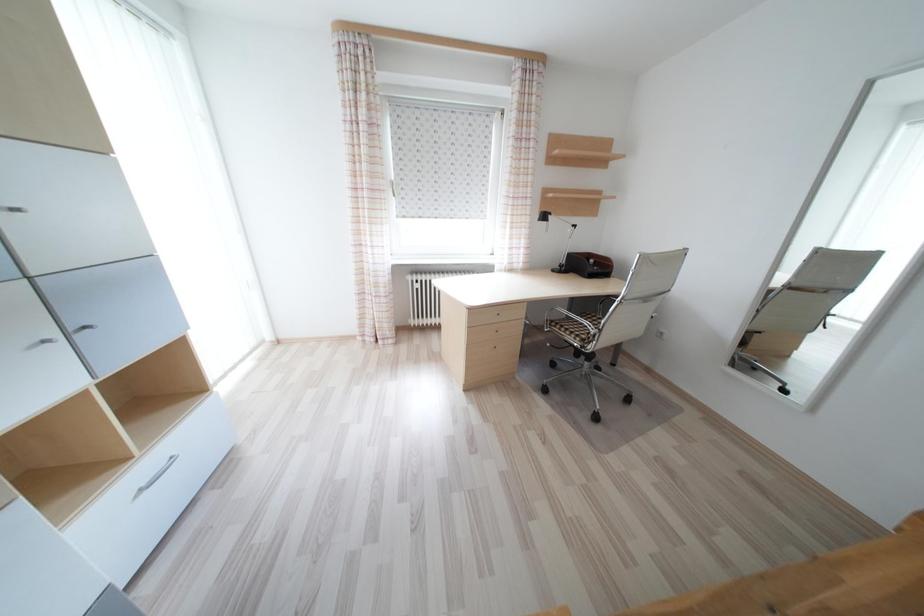
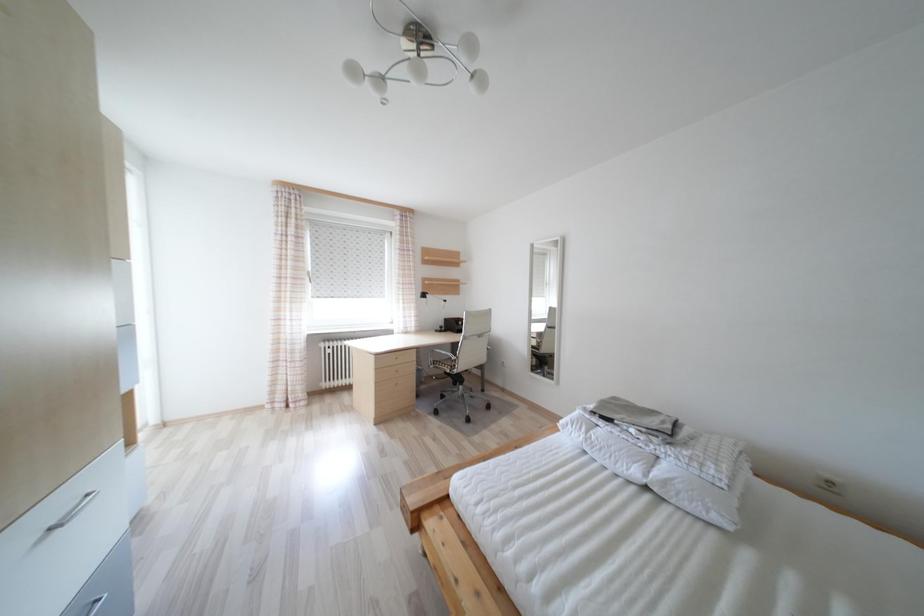
Question: Which direction would the cameraman need to move to produce the second image? Reply with the corresponding letter.

Choices:
 (A) Left
 (B) Right
 (C) Forward
 (D) Backward

Answer: (D)